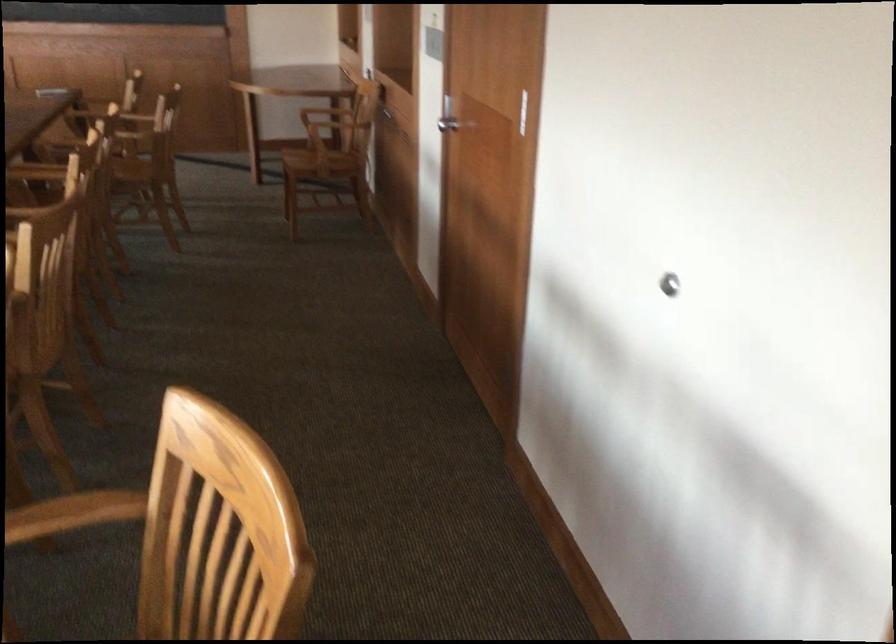
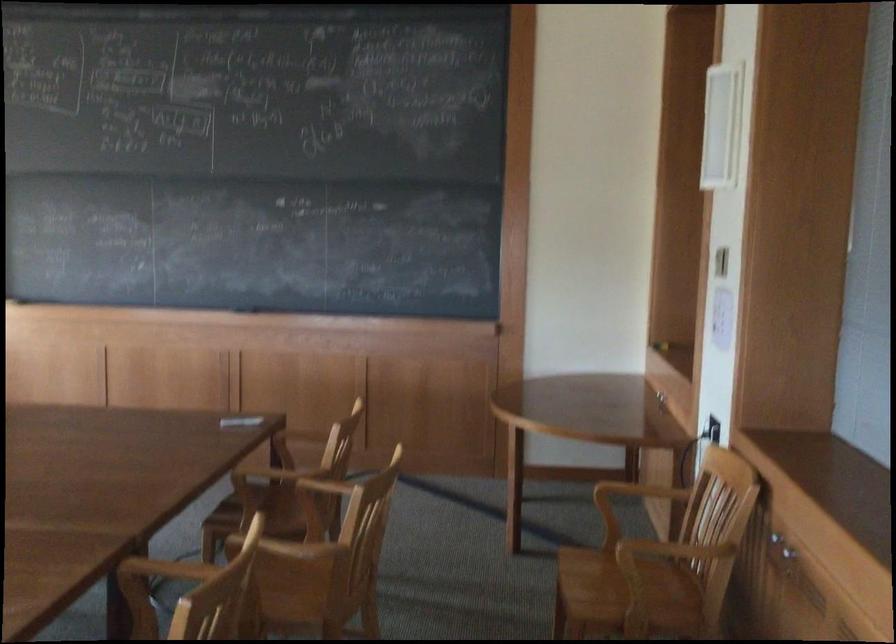
Find the pixel in the second image that matches pixel 174 106 in the first image.

(638, 491)